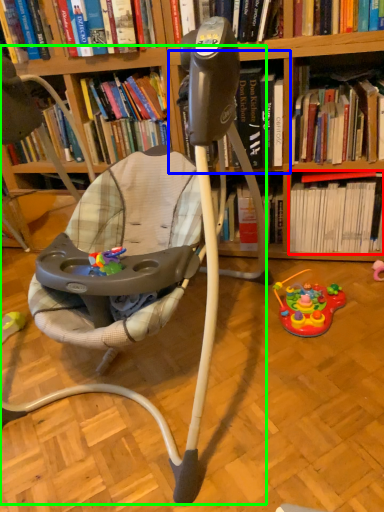
Question: Which object is positioned closest to book (highlighted by a red box)? Select from shelf (highlighted by a blue box) and baby carriage (highlighted by a green box).

Choices:
 (A) shelf
 (B) baby carriage

Answer: (A)